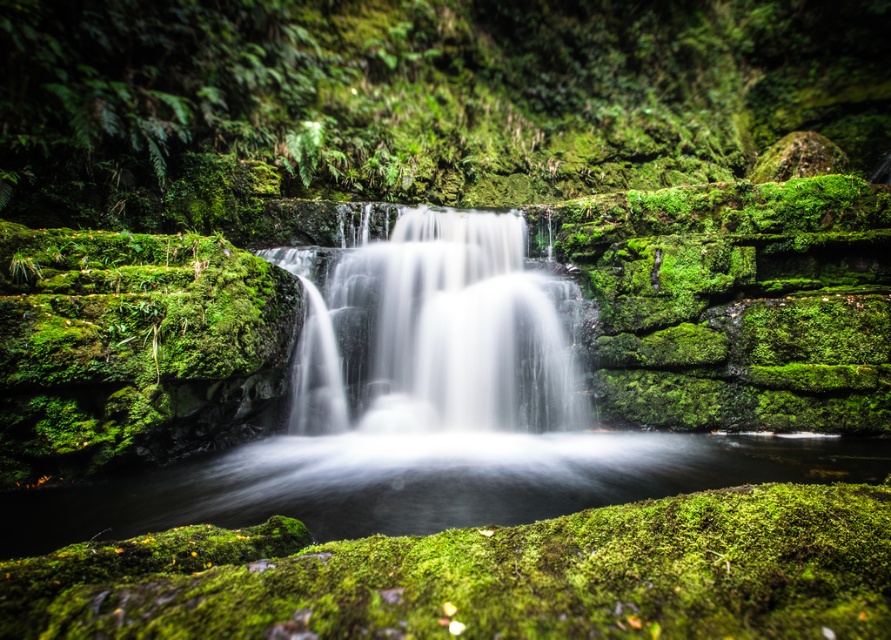
From the picture: You are a photographer standing at the edge of the waterfall. You want to capture a photo where the green mossy rock at center and the white silky water at center are both visible. Based on their positions, which object should you adjust your camera to focus on first to ensure both are in frame?

Since the green mossy rock at center is to the right of the white silky water at center, you should focus on the white silky water at center first to ensure both are in frame.

Consider the image. You are a photographer planning to capture the waterfall scene. You want to ensure that the green mossy rock at center and the white silky water at center are both visible in your shot. Given that your camera frame can only accommodate objects up to the width of the wider of the two, which object determines the minimum required frame width?

The green mossy rock at center has a greater width than the white silky water at center, so the minimum required frame width must be at least the width of the green mossy rock at center to ensure both are fully visible.

You are a hiker carrying a 10 foot long ladder. You need to cross the white silky water at center, but there is a green mossy rock at center in the way. Can you place the ladder between them to cross?

The distance between the green mossy rock at center and the white silky water at center is 12.83 feet. Since the ladder is 10 feet long, it is shorter than the required distance, so the ladder cannot span the gap between them. You will need a longer ladder or another method to cross.